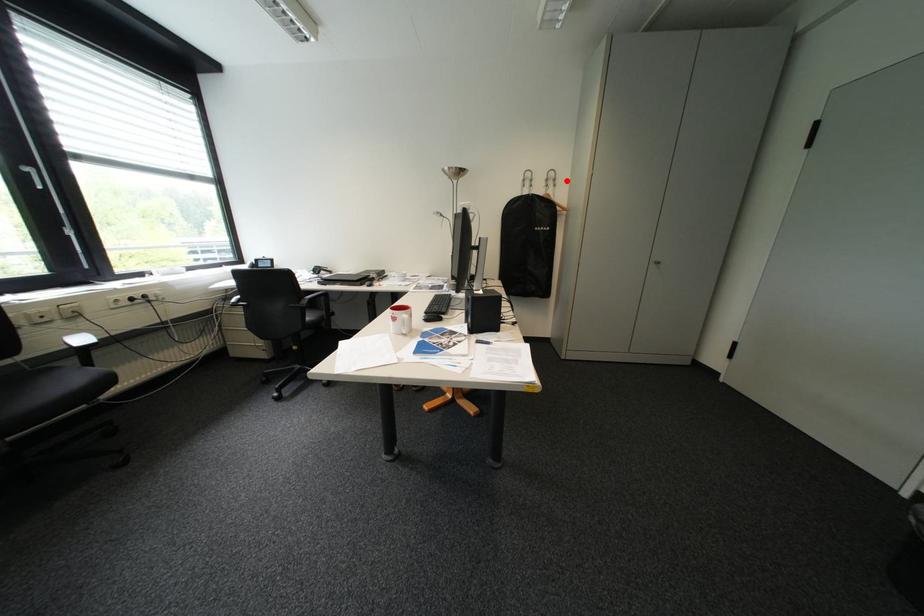
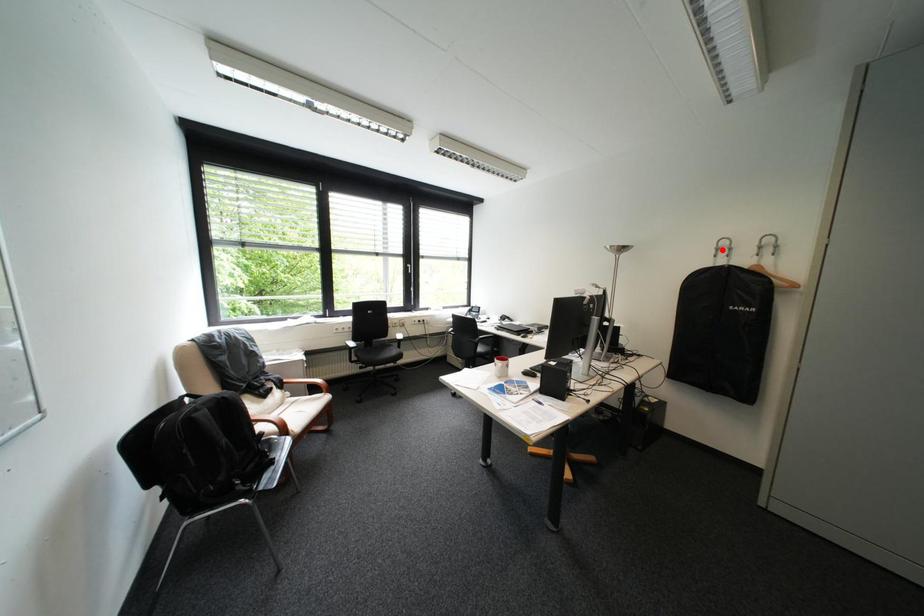
I am providing you with two images of the same scene from different viewpoints. A red point is marked on the first image and another point is marked on the second image. Are the points marked in image1 and image2 representing the same 3D position?

No